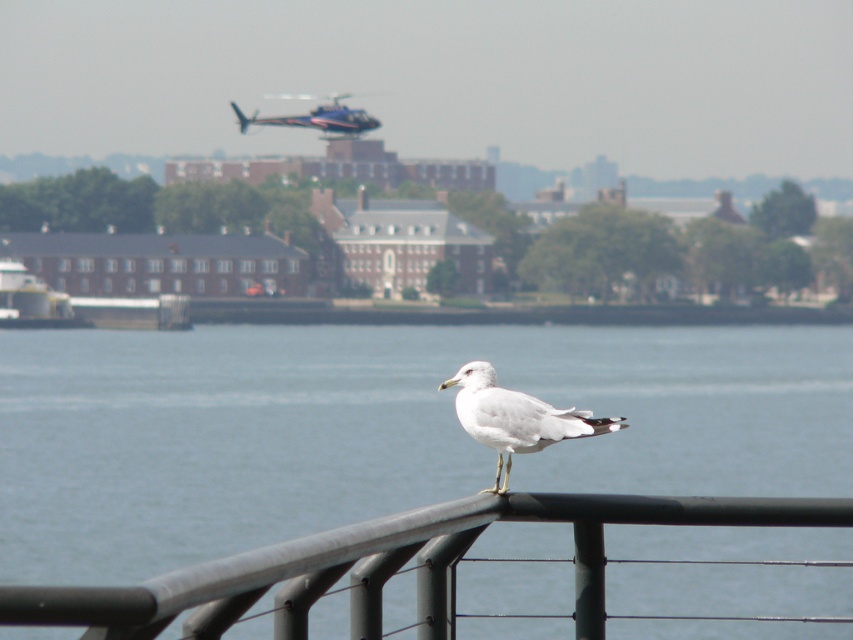
Between point (448, 637) and point (492, 378), which one is positioned behind?

Point (492, 378)

Who is positioned more to the left, black metal fence at lower center or white feathered bird at center?

black metal fence at lower center is more to the left.

Does point (309, 540) come in front of point (605, 426)?

Yes, point (309, 540) is closer to viewer.

The image size is (853, 640). In order to click on black metal fence at lower center in this screenshot , I will do `click(389, 564)`.

Is clear blue water at center positioned behind white feathered bird at center?

No, clear blue water at center is closer to the viewer.

Does point (811, 355) lie in front of point (541, 449)?

No, it is not.

At what (x,y) coordinates should I click in order to perform the action: click on clear blue water at center. Please return your answer as a coordinate pair (x, y). The width and height of the screenshot is (853, 640). Looking at the image, I should click on (376, 429).

What do you see at coordinates (376, 429) in the screenshot?
I see `clear blue water at center` at bounding box center [376, 429].

Based on the photo, does clear blue water at center have a lesser width compared to black metal fence at lower center?

In fact, clear blue water at center might be wider than black metal fence at lower center.

Locate an element on the screen. The width and height of the screenshot is (853, 640). clear blue water at center is located at coordinates (376, 429).

Where is `clear blue water at center`? This screenshot has width=853, height=640. clear blue water at center is located at coordinates (376, 429).